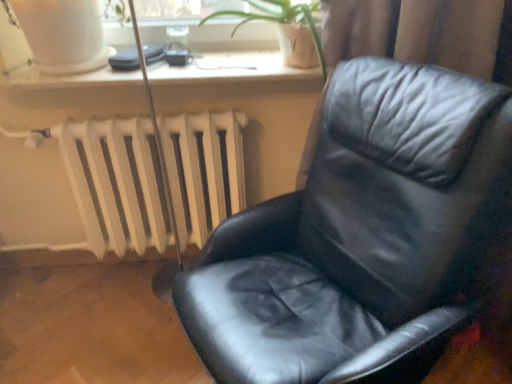
Question: Is point (117, 200) positioned closer to the camera than point (192, 271)?

Choices:
 (A) closer
 (B) farther

Answer: (B)

Question: Relative to black leather chair at center, is white matte radiator at lower left in front or behind?

Choices:
 (A) front
 (B) behind

Answer: (B)

Question: Based on their relative distances, which object is nearer to the white matte radiator at lower left?

Choices:
 (A) black leather chair at center
 (B) white plastic window sill at upper center
 (C) green leafy plant at upper center

Answer: (B)

Question: Which object is the closest to the green leafy plant at upper center?

Choices:
 (A) white matte radiator at lower left
 (B) black leather chair at center
 (C) white plastic window sill at upper center

Answer: (C)